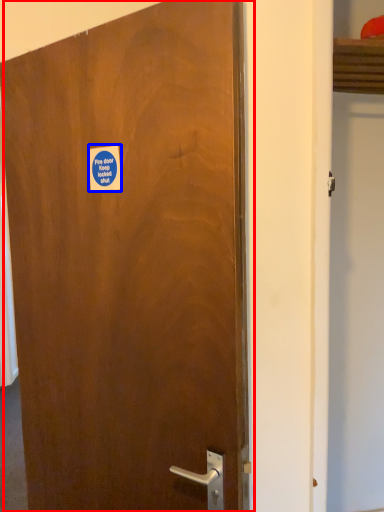
Question: Among these objects, which one is farthest to the camera, door (highlighted by a red box) or sticker (highlighted by a blue box)?

Choices:
 (A) door
 (B) sticker

Answer: (B)